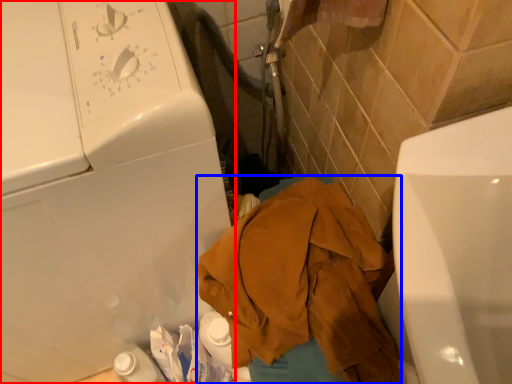
Question: Which of the following is the farthest to the observer, washing machine (highlighted by a red box) or clothing (highlighted by a blue box)?

Choices:
 (A) washing machine
 (B) clothing

Answer: (B)